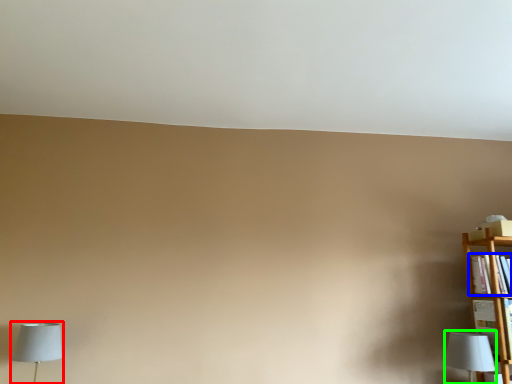
Question: Which is nearer to the lamp (highlighted by a red box)? book (highlighted by a blue box) or lamp (highlighted by a green box).

Choices:
 (A) book
 (B) lamp

Answer: (B)